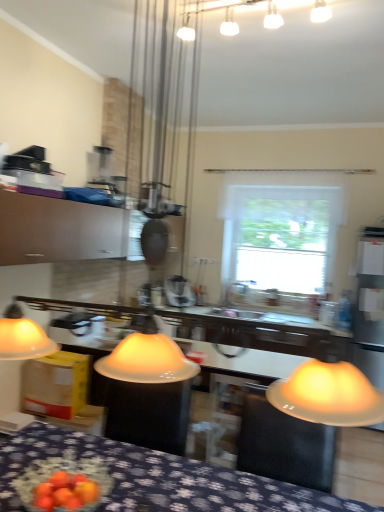
Question: Which is correct: white matte window at center is inside white glossy sink at center, or outside of it?

Choices:
 (A) inside
 (B) outside

Answer: (B)

Question: Looking at their shapes, would you say white matte window at center is wider or thinner than white glossy sink at center?

Choices:
 (A) thin
 (B) wide

Answer: (B)

Question: Estimate the real-world distances between objects in this image. Which object is farther from the metallic silver blender at center?

Choices:
 (A) white frosted glass light fixture at upper center
 (B) matte white cabinet at upper left
 (C) white matte window at center
 (D) blue fabric tablecloth at lower center
 (E) white glossy sink at center

Answer: (A)

Question: Which of these objects is positioned farthest from the matte white cabinet at upper left?

Choices:
 (A) metallic silver blender at center
 (B) white glossy sink at center
 (C) white frosted glass light fixture at upper center
 (D) blue fabric tablecloth at lower center
 (E) white matte window at center

Answer: (E)